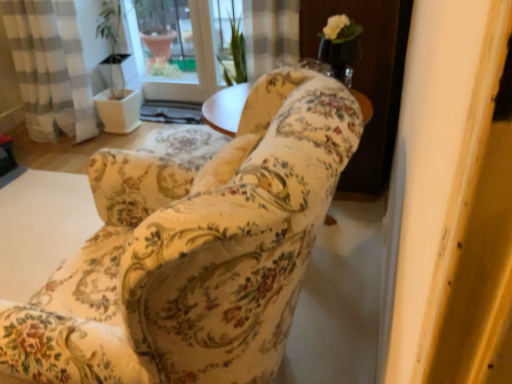
Locate an element on the screen. The image size is (512, 384). floral fabric chair at center is located at coordinates (193, 249).

What is the approximate height of floral fabric chair at center?

floral fabric chair at center is 91.81 centimeters in height.

Describe the element at coordinates (193, 249) in the screenshot. I see `floral fabric chair at center` at that location.

Describe the element at coordinates (368, 79) in the screenshot. The width and height of the screenshot is (512, 384). I see `white glossy screen door at upper center` at that location.

In order to face white glossy screen door at upper center, should I rotate leftwards or rightwards?

Turn right by 11.500 degrees to look at white glossy screen door at upper center.

Where is `white glossy screen door at upper center`? This screenshot has height=384, width=512. white glossy screen door at upper center is located at coordinates (368, 79).

The width and height of the screenshot is (512, 384). Find the location of `floral fabric chair at center`. floral fabric chair at center is located at coordinates (193, 249).

Is floral fabric chair at center to the left of white glossy screen door at upper center from the viewer's perspective?

Yes.

Does floral fabric chair at center lie behind white glossy screen door at upper center?

No, it is in front of white glossy screen door at upper center.

Considering the positions of point (161, 355) and point (368, 88), is point (161, 355) closer or farther from the camera than point (368, 88)?

Point (161, 355) is positioned closer to the camera compared to point (368, 88).

Consider the image. From the image's perspective, which object appears higher, floral fabric chair at center or white glossy screen door at upper center?

white glossy screen door at upper center, from the image's perspective.

From a real-world perspective, between floral fabric chair at center and white glossy screen door at upper center, who is vertically lower?

In real-world perspective, floral fabric chair at center is lower.

Can you confirm if floral fabric chair at center is thinner than white glossy screen door at upper center?

No.

Does floral fabric chair at center have a lesser height compared to white glossy screen door at upper center?

In fact, floral fabric chair at center may be taller than white glossy screen door at upper center.

Based on the photo, does floral fabric chair at center have a smaller size compared to white glossy screen door at upper center?

No.

Is floral fabric chair at center inside or outside of white glossy screen door at upper center?

floral fabric chair at center is outside white glossy screen door at upper center.

Is floral fabric chair at center next to white glossy screen door at upper center and touching it?

floral fabric chair at center is not next to white glossy screen door at upper center, and they're not touching.

Based on the photo, could you tell me if floral fabric chair at center is facing white glossy screen door at upper center?

No, floral fabric chair at center is not facing towards white glossy screen door at upper center.

Where is `screen door above the floral fabric chair at center (from a real-world perspective)`? Image resolution: width=512 pixels, height=384 pixels. screen door above the floral fabric chair at center (from a real-world perspective) is located at coordinates (368, 79).

Considering the relative positions of white glossy screen door at upper center and floral fabric chair at center in the image provided, is white glossy screen door at upper center to the left of floral fabric chair at center from the viewer's perspective?

No, white glossy screen door at upper center is not to the left of floral fabric chair at center.

Which object is closer to the camera, white glossy screen door at upper center or floral fabric chair at center?

floral fabric chair at center is more forward.

Between point (362, 68) and point (112, 156), which one is positioned behind?

The point (362, 68) is behind.

From the image's perspective, would you say white glossy screen door at upper center is positioned over floral fabric chair at center?

Yes, from the image's perspective, white glossy screen door at upper center is on top of floral fabric chair at center.

From a real-world perspective, which object stands above the other?

white glossy screen door at upper center is physically above.

Considering the relative sizes of white glossy screen door at upper center and floral fabric chair at center in the image provided, is white glossy screen door at upper center thinner than floral fabric chair at center?

Indeed, white glossy screen door at upper center has a lesser width compared to floral fabric chair at center.

Considering the sizes of objects white glossy screen door at upper center and floral fabric chair at center in the image provided, who is taller, white glossy screen door at upper center or floral fabric chair at center?

floral fabric chair at center.

Considering the sizes of white glossy screen door at upper center and floral fabric chair at center in the image, is white glossy screen door at upper center bigger or smaller than floral fabric chair at center?

white glossy screen door at upper center is smaller than floral fabric chair at center.

Is white glossy screen door at upper center not inside floral fabric chair at center?

Absolutely, white glossy screen door at upper center is external to floral fabric chair at center.

Does white glossy screen door at upper center touch floral fabric chair at center?

No, white glossy screen door at upper center is not with floral fabric chair at center.

Is floral fabric chair at center at the back of white glossy screen door at upper center?

No, white glossy screen door at upper center's orientation is not away from floral fabric chair at center.

Locate an element on the screen. The height and width of the screenshot is (384, 512). chair located underneath the white glossy screen door at upper center (from a real-world perspective) is located at coordinates (193, 249).

Image resolution: width=512 pixels, height=384 pixels. In order to click on chair in front of the white glossy screen door at upper center in this screenshot , I will do `click(193, 249)`.

Identify the location of chair below the white glossy screen door at upper center (from the image's perspective). This screenshot has height=384, width=512. (193, 249).